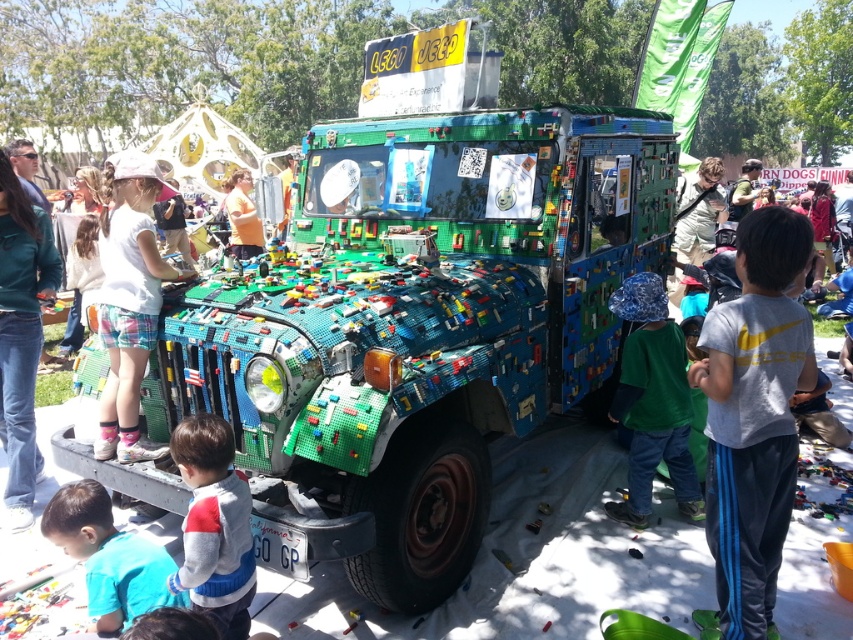
Who is shorter, multicolored plastic blocks at center or gray sweater at lower left?

Standing shorter between the two is gray sweater at lower left.

Is multicolored plastic blocks at center closer to the viewer compared to gray sweater at lower left?

No, multicolored plastic blocks at center is behind gray sweater at lower left.

Identify the location of multicolored plastic blocks at center. The image size is (853, 640). (422, 323).

Which is behind, point (300, 198) or point (91, 602)?

Point (300, 198)

This screenshot has width=853, height=640. In order to click on multicolored plastic blocks at center in this screenshot , I will do `click(422, 323)`.

Is point (134, 221) in front of point (634, 369)?

That is True.

Who is more forward, (119, 356) or (656, 337)?

Point (119, 356) is more forward.

Find the location of a particular element. The height and width of the screenshot is (640, 853). white cotton shirt at center is located at coordinates (129, 300).

Identify the location of white cotton shirt at center. (129, 300).